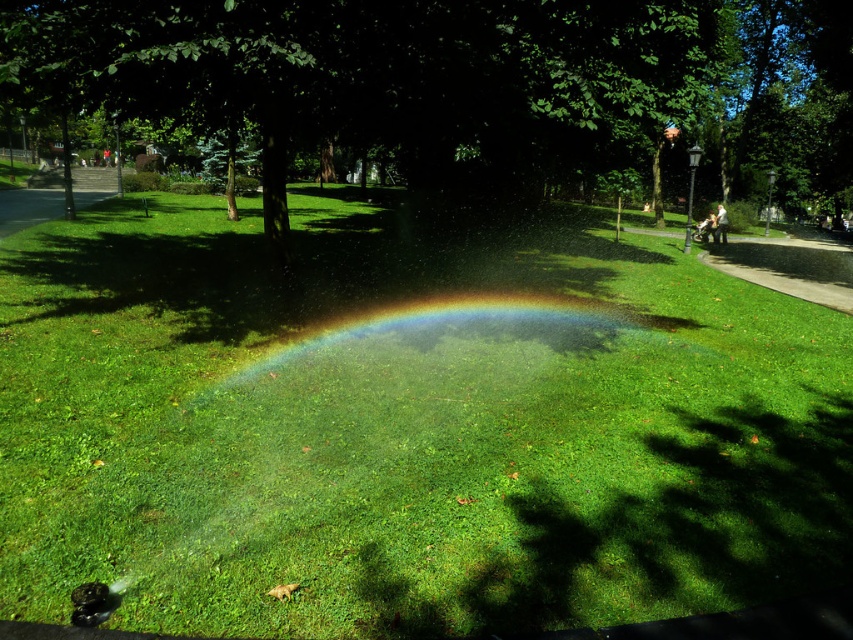
You are a park visitor standing at the entrance and want to reach the rainbow at center. The green leafy tree at center is blocking your path. Can you walk around it without getting too close to the tree?

The green leafy tree at center is 42.36 meters away from the rainbow at center, so you can easily walk around the tree while maintaining a safe distance to reach the rainbow at center.

You are standing in the park and notice the green grass at center and the green leafy tree at center. Which object is closer to the ground?

The green grass at center is located below the green leafy tree at center, so it is closer to the ground.